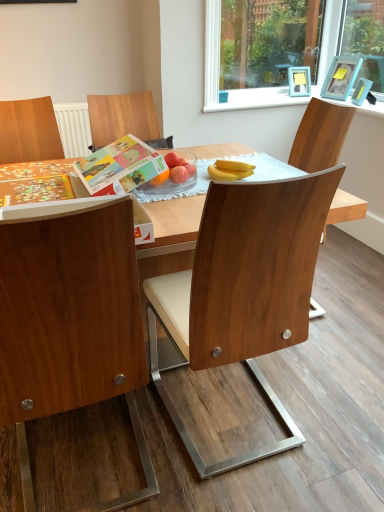
Question: Is point (127, 137) positioned closer to the camera than point (243, 96)?

Choices:
 (A) closer
 (B) farther

Answer: (A)

Question: Is matte paper book at center situated inside white plastic window frame at upper right or outside?

Choices:
 (A) outside
 (B) inside

Answer: (A)

Question: Which is nearer to the white plastic window frame at upper right?

Choices:
 (A) yellow matte bananas at center
 (B) wooden chair at center, the 2th chair when ordered from left to right
 (C) matte paper book at center
 (D) blue plastic picture frame at upper right, which is the 1th picture frame from top to bottom
 (E) wooden chair at left, marked as the first chair in a left-to-right arrangement

Answer: (D)

Question: Based on their relative distances, which object is farther from the wooden chair at center, the 2th chair when ordered from left to right?

Choices:
 (A) wooden chair at left, placed as the 2th chair when sorted from right to left
 (B) blue plastic picture frame at upper right, arranged as the first picture frame when ordered from the bottom
 (C) yellow matte bananas at center
 (D) matte paper book at center
 (E) white plastic window frame at upper right

Answer: (B)